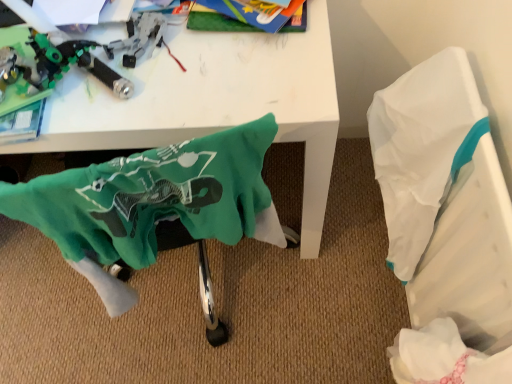
What do you see at coordinates (69, 59) in the screenshot? I see `translucent plastic toy gun at upper left` at bounding box center [69, 59].

This screenshot has width=512, height=384. I want to click on white glossy table at upper center, so click(x=211, y=102).

Locate an element on the screen. green fabric swivel chair at lower left is located at coordinates (155, 209).

Find the location of a particular element. translucent plastic toy gun at upper left is located at coordinates (69, 59).

Measure the distance between green fabric swivel chair at lower left and white glossy table at upper center.

They are 7.40 inches apart.

Does green fabric swivel chair at lower left have a lesser height compared to white glossy table at upper center?

Yes.

Visually, is green fabric swivel chair at lower left positioned to the left or to the right of white glossy table at upper center?

Based on their positions, green fabric swivel chair at lower left is located to the right of white glossy table at upper center.

From the image's perspective, is green fabric swivel chair at lower left over white glossy table at upper center?

No, from the image's perspective, green fabric swivel chair at lower left is not on top of white glossy table at upper center.

Is translucent plastic toy gun at upper left oriented towards white glossy table at upper center?

Yes, translucent plastic toy gun at upper left is aimed at white glossy table at upper center.

In terms of width, does translucent plastic toy gun at upper left look wider or thinner when compared to white glossy table at upper center?

Considering their sizes, translucent plastic toy gun at upper left looks slimmer than white glossy table at upper center.

From a real-world perspective, is translucent plastic toy gun at upper left located beneath white glossy table at upper center?

No, from a real-world perspective, translucent plastic toy gun at upper left is not beneath white glossy table at upper center.

Would you say translucent plastic toy gun at upper left is to the left or to the right of white glossy table at upper center in the picture?

Based on their positions, translucent plastic toy gun at upper left is located to the left of white glossy table at upper center.

Identify the location of toy above the white paper at right (from a real-world perspective). Image resolution: width=512 pixels, height=384 pixels. (69, 59).

Considering the sizes of white paper at right and translucent plastic toy gun at upper left in the image, is white paper at right taller or shorter than translucent plastic toy gun at upper left?

white paper at right is taller than translucent plastic toy gun at upper left.

Who is bigger, white paper at right or translucent plastic toy gun at upper left?

white paper at right.

How much distance is there between white paper at right and translucent plastic toy gun at upper left?

The distance of white paper at right from translucent plastic toy gun at upper left is 22.46 inches.

Which object is wider, white glossy table at upper center or white paper at right?

white glossy table at upper center is wider.

Is white glossy table at upper center aimed at white paper at right?

No, white glossy table at upper center is not turned towards white paper at right.

Identify the location of wrapping paper that is behind the white glossy table at upper center. (445, 224).

Does point (133, 138) come closer to viewer compared to point (426, 120)?

Yes, it is in front of point (426, 120).

Is green fabric swivel chair at lower left completely or partially inside translucent plastic toy gun at upper left?

No, translucent plastic toy gun at upper left does not contain green fabric swivel chair at lower left.

Between translucent plastic toy gun at upper left and green fabric swivel chair at lower left, which one appears on the left side from the viewer's perspective?

translucent plastic toy gun at upper left.

Does translucent plastic toy gun at upper left have a larger size compared to green fabric swivel chair at lower left?

No, translucent plastic toy gun at upper left is not bigger than green fabric swivel chair at lower left.

Does point (161, 40) appear closer or farther from the camera than point (110, 199)?

Point (161, 40) appears to be farther away from the viewer than point (110, 199).

Is green fabric swivel chair at lower left to the right of translucent plastic toy gun at upper left from the viewer's perspective?

Indeed, green fabric swivel chair at lower left is positioned on the right side of translucent plastic toy gun at upper left.

The width and height of the screenshot is (512, 384). I want to click on swivel chair in front of the translucent plastic toy gun at upper left, so click(x=155, y=209).

Which is behind, point (270, 239) or point (154, 30)?

The point (154, 30) is behind.

Would you say green fabric swivel chair at lower left is outside translucent plastic toy gun at upper left?

green fabric swivel chair at lower left lies outside translucent plastic toy gun at upper left's area.

Considering the sizes of translucent plastic toy gun at upper left and white paper at right in the image, is translucent plastic toy gun at upper left wider or thinner than white paper at right?

Considering their sizes, translucent plastic toy gun at upper left looks slimmer than white paper at right.

Where is `toy above the white paper at right (from a real-world perspective)`? This screenshot has height=384, width=512. toy above the white paper at right (from a real-world perspective) is located at coordinates coord(69,59).

Consider the image. Between translucent plastic toy gun at upper left and white paper at right, which one appears on the left side from the viewer's perspective?

translucent plastic toy gun at upper left.

Locate an element on the screen. The width and height of the screenshot is (512, 384). table below the green fabric swivel chair at lower left (from a real-world perspective) is located at coordinates (211, 102).

I want to click on toy located behind the white glossy table at upper center, so click(69, 59).

When comparing their distances from white paper at right, does green fabric swivel chair at lower left or white glossy table at upper center seem further?

Based on the image, green fabric swivel chair at lower left appears to be further to white paper at right.

When comparing their distances from white glossy table at upper center, does translucent plastic toy gun at upper left or green fabric swivel chair at lower left seem further?

green fabric swivel chair at lower left is positioned further to the anchor white glossy table at upper center.

Estimate the real-world distances between objects in this image. Which object is closer to green fabric swivel chair at lower left, white paper at right or translucent plastic toy gun at upper left?

translucent plastic toy gun at upper left is closer to green fabric swivel chair at lower left.

From the image, which object appears to be farther from translucent plastic toy gun at upper left, white glossy table at upper center or green fabric swivel chair at lower left?

green fabric swivel chair at lower left is further to translucent plastic toy gun at upper left.

Based on their spatial positions, is white glossy table at upper center or translucent plastic toy gun at upper left closer to white paper at right?

The object closer to white paper at right is white glossy table at upper center.

Estimate the real-world distances between objects in this image. Which object is further from green fabric swivel chair at lower left, white glossy table at upper center or white paper at right?

white paper at right lies further to green fabric swivel chair at lower left than the other object.

From the image, which object appears to be nearer to translucent plastic toy gun at upper left, white paper at right or green fabric swivel chair at lower left?

green fabric swivel chair at lower left is closer to translucent plastic toy gun at upper left.

Considering their positions, is green fabric swivel chair at lower left positioned further to white paper at right than translucent plastic toy gun at upper left?

Among the two, translucent plastic toy gun at upper left is located further to white paper at right.

Where is `table between translucent plastic toy gun at upper left and green fabric swivel chair at lower left from top to bottom`? This screenshot has height=384, width=512. table between translucent plastic toy gun at upper left and green fabric swivel chair at lower left from top to bottom is located at coordinates (211, 102).

At what (x,y) coordinates should I click in order to perform the action: click on swivel chair situated between white glossy table at upper center and white paper at right from left to right. Please return your answer as a coordinate pair (x, y). The height and width of the screenshot is (384, 512). Looking at the image, I should click on (155, 209).

Find the location of `swivel chair between translucent plastic toy gun at upper left and white paper at right`. swivel chair between translucent plastic toy gun at upper left and white paper at right is located at coordinates (155, 209).

The image size is (512, 384). Identify the location of table situated between translucent plastic toy gun at upper left and white paper at right from left to right. (211, 102).